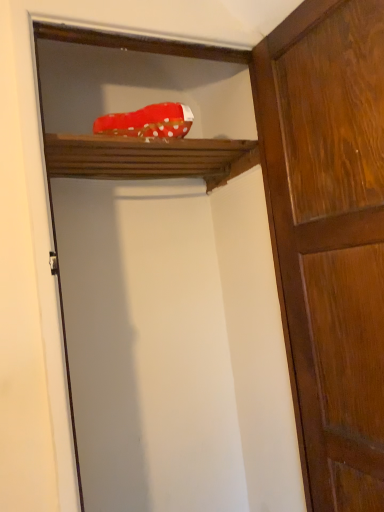
Question: Considering the relative sizes of wooden shelf at upper center and red polka dot fabric at upper center in the image provided, is wooden shelf at upper center thinner than red polka dot fabric at upper center?

Choices:
 (A) no
 (B) yes

Answer: (A)

Question: Is wooden shelf at upper center looking in the opposite direction of red polka dot fabric at upper center?

Choices:
 (A) no
 (B) yes

Answer: (A)

Question: From the image's perspective, is wooden shelf at upper center on red polka dot fabric at upper center?

Choices:
 (A) yes
 (B) no

Answer: (B)

Question: Is wooden shelf at upper center aimed at red polka dot fabric at upper center?

Choices:
 (A) no
 (B) yes

Answer: (A)

Question: Is wooden shelf at upper center positioned before red polka dot fabric at upper center?

Choices:
 (A) yes
 (B) no

Answer: (B)

Question: In the image, is shiny brown wood door at right positioned in front of or behind wooden shelf at upper center?

Choices:
 (A) behind
 (B) front

Answer: (B)

Question: Is shiny brown wood door at right wider or thinner than wooden shelf at upper center?

Choices:
 (A) wide
 (B) thin

Answer: (B)

Question: From a real-world perspective, is shiny brown wood door at right above or below wooden shelf at upper center?

Choices:
 (A) above
 (B) below

Answer: (B)

Question: Visually, is shiny brown wood door at right positioned to the left or to the right of wooden shelf at upper center?

Choices:
 (A) right
 (B) left

Answer: (A)

Question: Considering the positions of point (337, 261) and point (162, 119), is point (337, 261) closer or farther from the camera than point (162, 119)?

Choices:
 (A) farther
 (B) closer

Answer: (B)

Question: Is shiny brown wood door at right in front of or behind red polka dot fabric at upper center in the image?

Choices:
 (A) behind
 (B) front

Answer: (B)

Question: From the image's perspective, is shiny brown wood door at right above or below red polka dot fabric at upper center?

Choices:
 (A) above
 (B) below

Answer: (B)

Question: Is shiny brown wood door at right inside or outside of red polka dot fabric at upper center?

Choices:
 (A) inside
 (B) outside

Answer: (B)

Question: From the image's perspective, relative to shiny brown wood door at right, is wooden shelf at upper center above or below?

Choices:
 (A) below
 (B) above

Answer: (B)

Question: Relative to shiny brown wood door at right, is wooden shelf at upper center in front or behind?

Choices:
 (A) front
 (B) behind

Answer: (B)